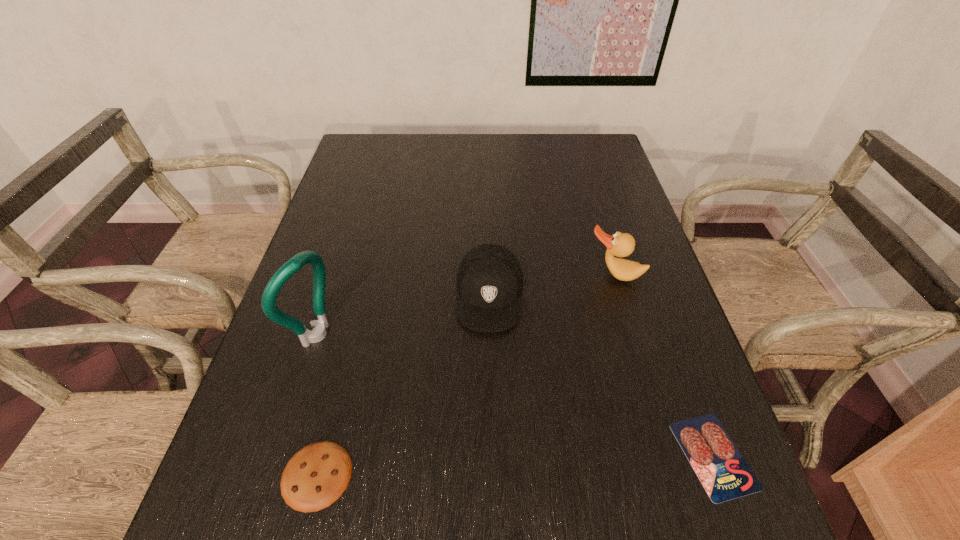
Image resolution: width=960 pixels, height=540 pixels. I want to click on blank space located 0.110m at the jaws of the tallest object, so click(371, 368).

Identify the location of vacant space located 0.280m on the front-facing side of the third shortest object. (479, 463).

At what (x,y) coordinates should I click in order to perform the action: click on free space located 0.060m on the front-facing side of the third shortest object. Please return your answer as a coordinate pair (x, y). Looking at the image, I should click on (487, 358).

You are a GUI agent. You are given a task and a screenshot of the screen. Output one action in this format:
    pyautogui.click(x=<x>, y=<y>)
    Task: Click on the vacant space situated 0.120m on the front-facing side of the third shortest object
    The height and width of the screenshot is (540, 960).
    Given the screenshot: What is the action you would take?
    pyautogui.click(x=485, y=383)

Identify the location of free spot located 0.050m on the beak of the fourth shortest object. (603, 300).

I want to click on vacant region located 0.320m on the beak of the fourth shortest object, so click(576, 396).

This screenshot has width=960, height=540. What are the coordinates of `free space located 0.400m on the beak of the fourth shortest object` in the screenshot? It's located at (566, 432).

Image resolution: width=960 pixels, height=540 pixels. What are the coordinates of `cookie that is at the near edge` in the screenshot? It's located at (316, 476).

This screenshot has height=540, width=960. Identify the location of salami located at the near edge. (724, 473).

You are a GUI agent. You are given a task and a screenshot of the screen. Output one action in this format:
    pyautogui.click(x=<x>, y=<y>)
    Task: Click on the cookie present at the left edge
    The image size is (960, 540).
    Given the screenshot: What is the action you would take?
    pyautogui.click(x=316, y=476)